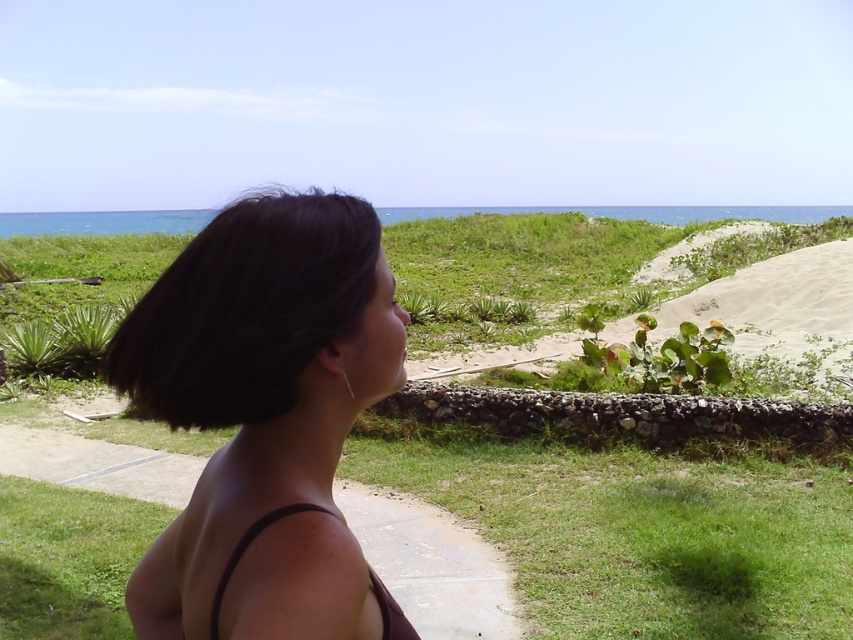
Question: Considering the relative positions of brown concrete path at lower center and black matte bikini top at lower left in the image provided, where is brown concrete path at lower center located with respect to black matte bikini top at lower left?

Choices:
 (A) right
 (B) left

Answer: (A)

Question: Can you confirm if dark shiny hair at center is thinner than brown concrete path at lower center?

Choices:
 (A) yes
 (B) no

Answer: (A)

Question: Which object is positioned closest to the dark brown hair at center?

Choices:
 (A) dark shiny hair at center
 (B) brown concrete path at lower center

Answer: (A)

Question: Among these points, which one is nearest to the camera?

Choices:
 (A) (183, 509)
 (B) (370, 573)
 (C) (178, 296)

Answer: (B)

Question: From the image, what is the correct spatial relationship of dark shiny hair at center in relation to black matte bikini top at lower left?

Choices:
 (A) left
 (B) right

Answer: (A)

Question: Which object is positioned closest to the dark brown hair at center?

Choices:
 (A) brown concrete path at lower center
 (B) dark shiny hair at center

Answer: (B)